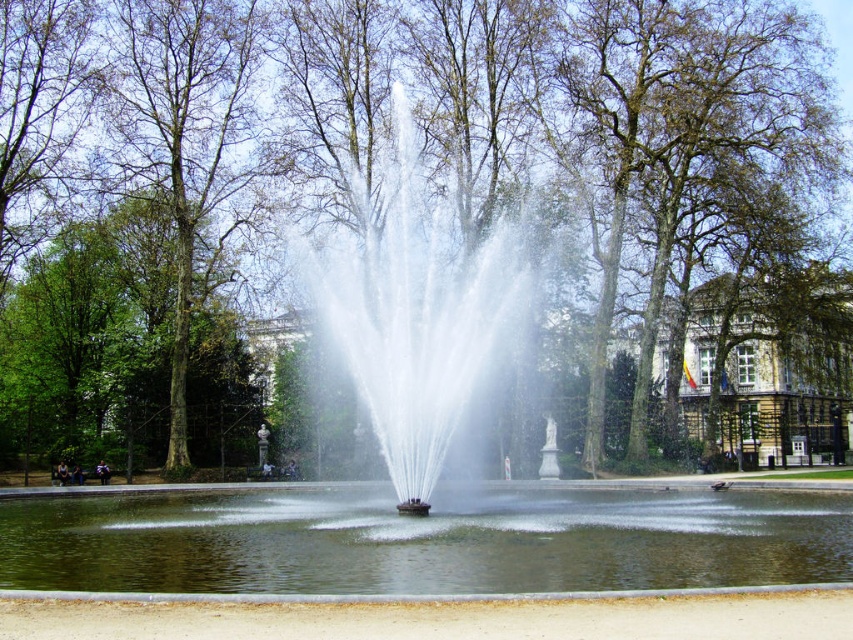
Which of these two, clear water fountain at center or brown stone building at center, stands shorter?

brown stone building at center

What do you see at coordinates (413, 312) in the screenshot? The image size is (853, 640). I see `clear water fountain at center` at bounding box center [413, 312].

The height and width of the screenshot is (640, 853). Find the location of `clear water fountain at center`. clear water fountain at center is located at coordinates (413, 312).

Which of these two, clear water at center or brown stone building at center, stands shorter?

Standing shorter between the two is clear water at center.

Where is `clear water at center`? This screenshot has width=853, height=640. clear water at center is located at coordinates (422, 540).

Image resolution: width=853 pixels, height=640 pixels. Describe the element at coordinates (422, 540) in the screenshot. I see `clear water at center` at that location.

Image resolution: width=853 pixels, height=640 pixels. In order to click on clear water at center in this screenshot , I will do `click(422, 540)`.

Which is behind, point (584, 548) or point (426, 268)?

The point (426, 268) is behind.

Is clear water at center smaller than clear water fountain at center?

Yes, clear water at center is smaller than clear water fountain at center.

Where is `clear water at center`? clear water at center is located at coordinates (422, 540).

Locate an element on the screen. clear water at center is located at coordinates (422, 540).